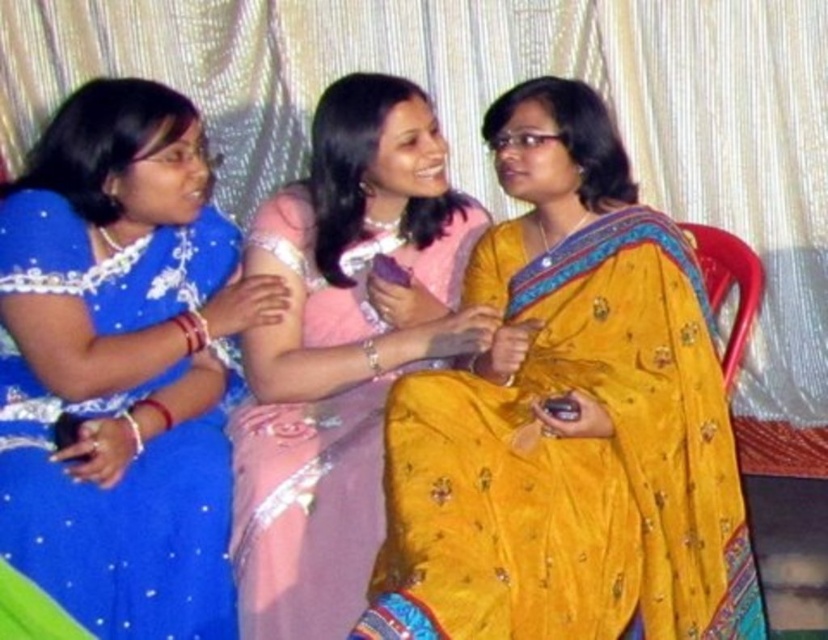
You are a photographer at a social event and need to capture a photo of the yellow satin saree at center and the pink satin saree at center. Which one should you focus on if you want to highlight the taller sari?

The yellow satin saree at center is taller than the pink satin saree at center, so focusing on the yellow satin saree at center would best highlight the taller sari.

You are at a social event and see two women wearing the yellow satin saree at center and the pink satin saree at center. Which saree is placed lower in the image?

The yellow satin saree at center is positioned under the pink satin saree at center, so the yellow one is lower.